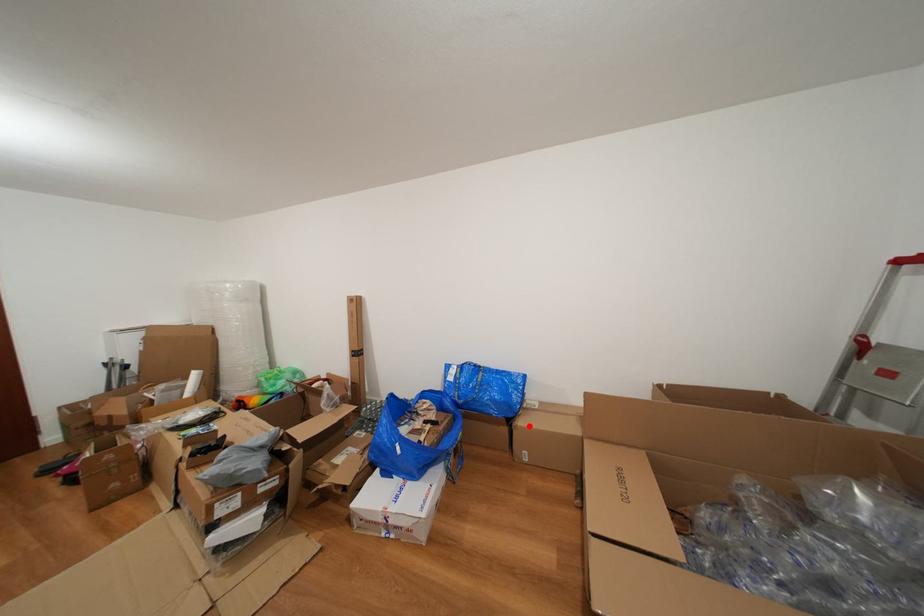
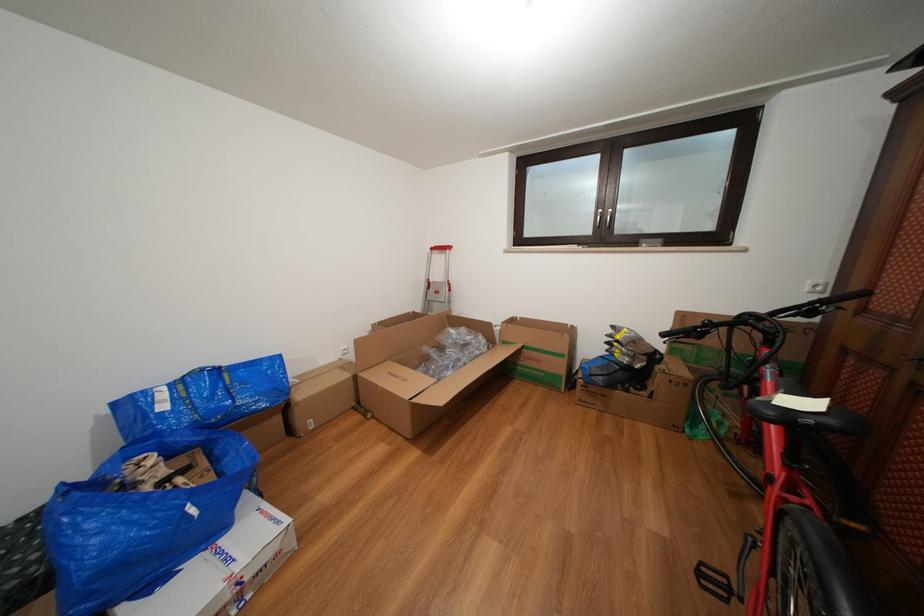
Locate, in the second image, the point that corresponds to the highlighted location in the first image.

(309, 400)